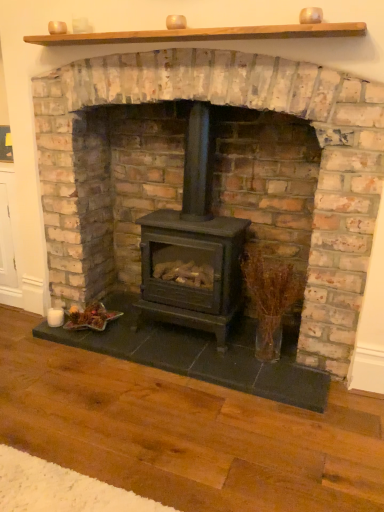
I want to click on vacant area located to the right-hand side of translucent glass vase at right, so click(x=302, y=365).